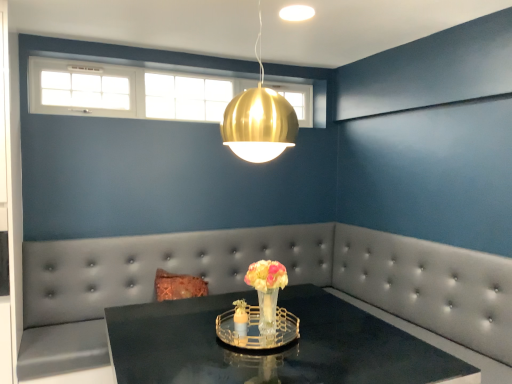
Question: Considering the relative sizes of translucent glass vase at center and tufted leather couch at center in the image provided, is translucent glass vase at center wider than tufted leather couch at center?

Choices:
 (A) no
 (B) yes

Answer: (A)

Question: From a real-world perspective, is translucent glass vase at center physically above tufted leather couch at center?

Choices:
 (A) no
 (B) yes

Answer: (B)

Question: Can you confirm if translucent glass vase at center is shorter than tufted leather couch at center?

Choices:
 (A) yes
 (B) no

Answer: (A)

Question: Is the depth of translucent glass vase at center greater than that of tufted leather couch at center?

Choices:
 (A) no
 (B) yes

Answer: (A)

Question: Can you see translucent glass vase at center touching tufted leather couch at center?

Choices:
 (A) no
 (B) yes

Answer: (A)

Question: From a real-world perspective, is tufted leather couch at center physically located above or below shiny black table at center?

Choices:
 (A) below
 (B) above

Answer: (B)

Question: Considering the positions of tufted leather couch at center and shiny black table at center in the image, is tufted leather couch at center taller or shorter than shiny black table at center?

Choices:
 (A) short
 (B) tall

Answer: (B)

Question: Is tufted leather couch at center in front of or behind shiny black table at center in the image?

Choices:
 (A) behind
 (B) front

Answer: (A)

Question: Is tufted leather couch at center situated inside shiny black table at center or outside?

Choices:
 (A) inside
 (B) outside

Answer: (B)

Question: From a real-world perspective, is tufted leather couch at center physically located above or below translucent glass vase at center?

Choices:
 (A) below
 (B) above

Answer: (A)

Question: Based on their positions, is tufted leather couch at center located to the left or right of translucent glass vase at center?

Choices:
 (A) right
 (B) left

Answer: (B)

Question: Do you think tufted leather couch at center is within translucent glass vase at center, or outside of it?

Choices:
 (A) inside
 (B) outside

Answer: (B)

Question: Considering their positions, is tufted leather couch at center located in front of or behind translucent glass vase at center?

Choices:
 (A) behind
 (B) front

Answer: (A)

Question: Based on their positions, is gold metallic sphere at upper center located to the left or right of translucent glass vase at center?

Choices:
 (A) left
 (B) right

Answer: (A)

Question: Considering the positions of gold metallic sphere at upper center and translucent glass vase at center in the image, is gold metallic sphere at upper center wider or thinner than translucent glass vase at center?

Choices:
 (A) thin
 (B) wide

Answer: (B)